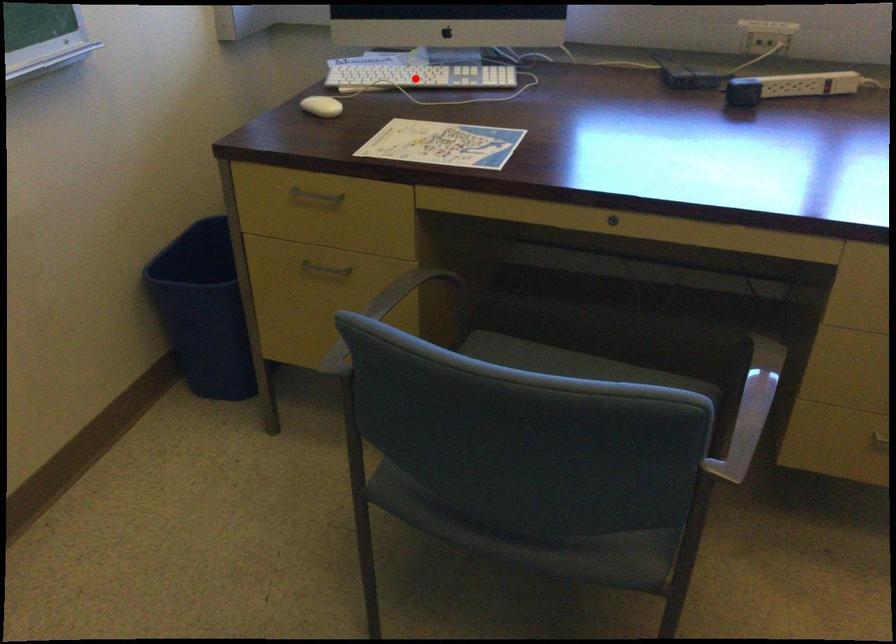
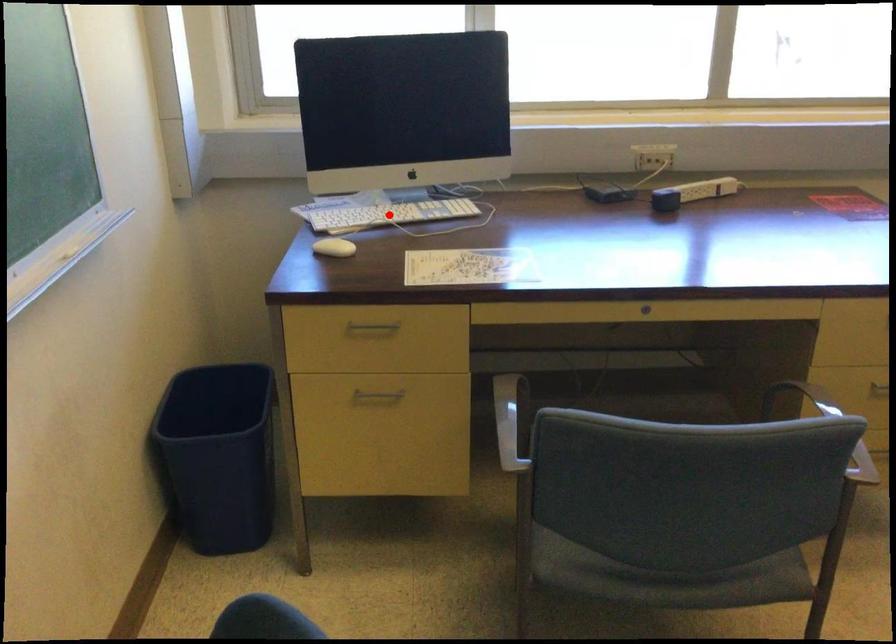
I am providing you with two images of the same scene from different viewpoints. A red point is marked on the first image and another point is marked on the second image. Are the points marked in image1 and image2 representing the same 3D position?

Yes